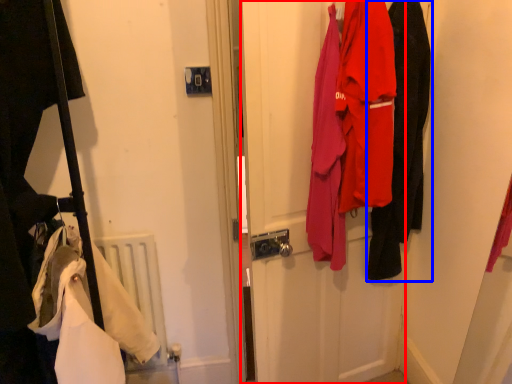
Question: Which point is further to the camera, door (highlighted by a red box) or clothing (highlighted by a blue box)?

Choices:
 (A) door
 (B) clothing

Answer: (B)